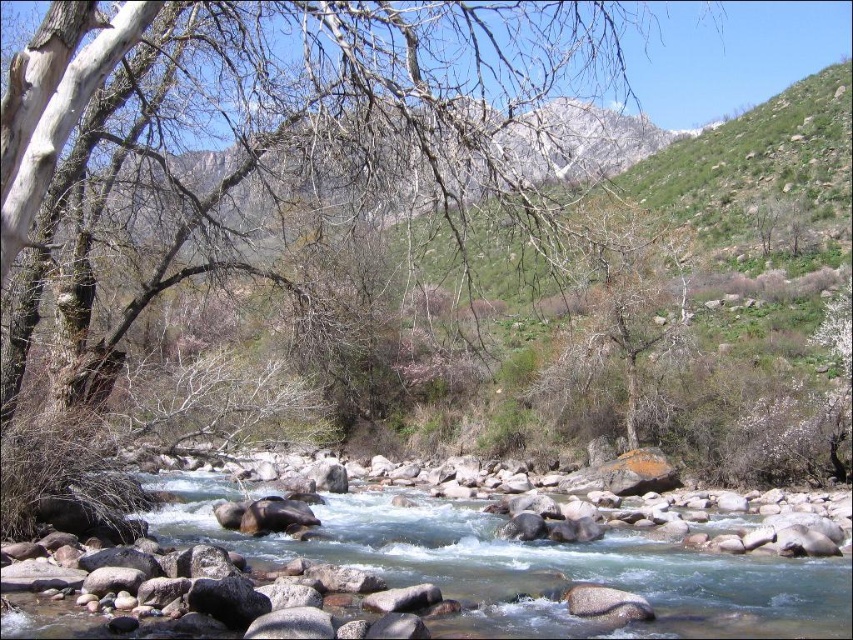
You are standing at the point marked by point (289, 140) in the image. Which direction should you walk to reach the smooth bark tree at center?

The point (289, 140) is the location of the smooth bark tree at center, so you are already at the tree.

You are a hiker trying to identify the trees in the scene. Which tree, the smooth bark tree at center or the gray bark tree at center, has a bigger size?

The smooth bark tree at center is larger in size than the gray bark tree at center.